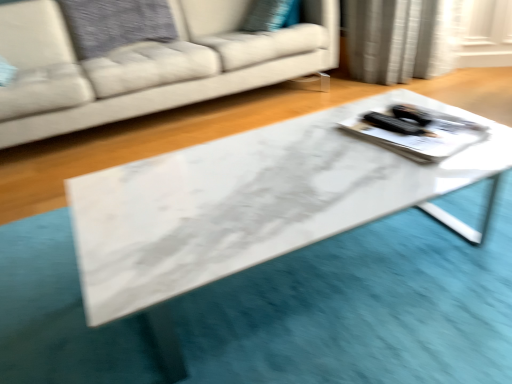
At what (x,y) coordinates should I click in order to perform the action: click on blank space situated above white marble table at center (from a real-world perspective). Please return your answer as a coordinate pair (x, y). The width and height of the screenshot is (512, 384). Looking at the image, I should click on (290, 168).